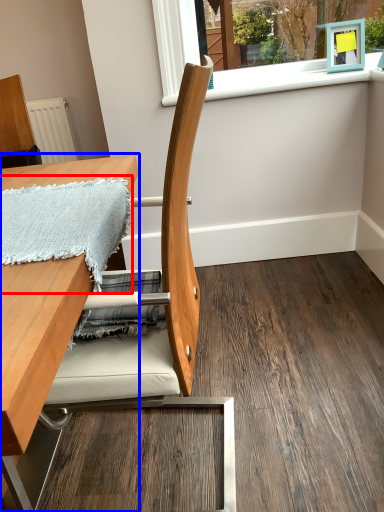
Question: Among these objects, which one is nearest to the camera, blanket (highlighted by a red box) or table (highlighted by a blue box)?

Choices:
 (A) blanket
 (B) table

Answer: (B)